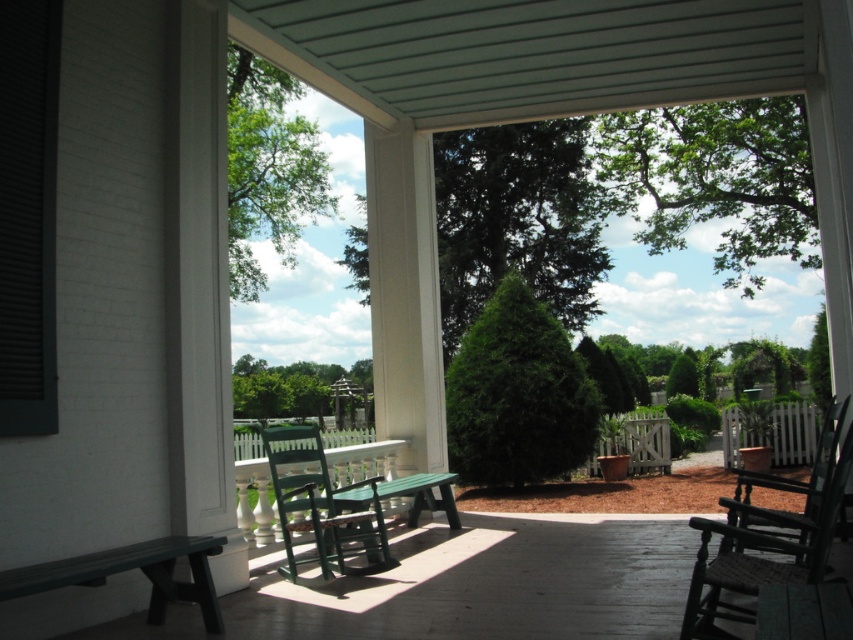
Is green painted wood bench at center thinner than green plastic bench at lower left?

No.

Can you confirm if green painted wood bench at center is wider than green plastic bench at lower left?

Correct, the width of green painted wood bench at center exceeds that of green plastic bench at lower left.

Who is more distant from viewer, (534,604) or (206,579)?

The point (534,604) is behind.

Locate an element on the screen. The image size is (853, 640). green painted wood bench at center is located at coordinates (471, 586).

The image size is (853, 640). What do you see at coordinates (769, 538) in the screenshot?
I see `rustic woven wood rocking chair at right` at bounding box center [769, 538].

Is point (799, 576) behind point (311, 513)?

That is False.

What are the coordinates of `rustic woven wood rocking chair at right` in the screenshot? It's located at (769, 538).

Does rustic woven wood rocking chair at right appear under green plastic bench at lower left?

No, rustic woven wood rocking chair at right is not below green plastic bench at lower left.

Who is positioned more to the right, rustic woven wood rocking chair at right or green plastic bench at lower left?

rustic woven wood rocking chair at right is more to the right.

Does point (844, 401) lie behind point (167, 563)?

Yes, point (844, 401) is farther from viewer.

Locate an element on the screen. This screenshot has height=640, width=853. rustic woven wood rocking chair at right is located at coordinates coord(769,538).